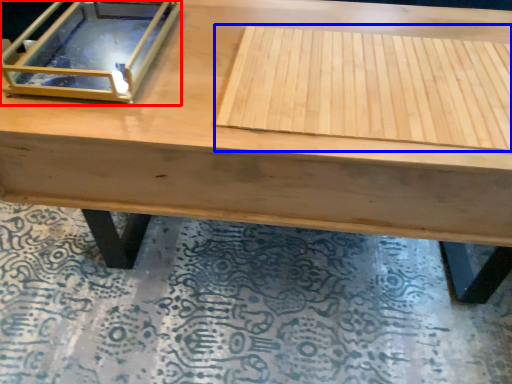
Question: Which point is further to the camera, glass box (highlighted by a red box) or plywood (highlighted by a blue box)?

Choices:
 (A) glass box
 (B) plywood

Answer: (A)